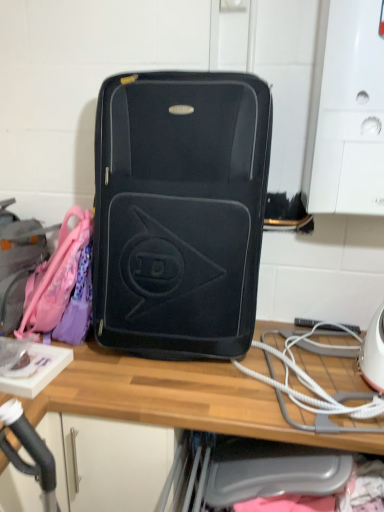
Question: Considering the relative sizes of matte black suitcase at center and wooden desk at center in the image provided, is matte black suitcase at center thinner than wooden desk at center?

Choices:
 (A) yes
 (B) no

Answer: (A)

Question: Is matte black suitcase at center beside wooden desk at center?

Choices:
 (A) yes
 (B) no

Answer: (B)

Question: From the image's perspective, does matte black suitcase at center appear lower than wooden desk at center?

Choices:
 (A) yes
 (B) no

Answer: (B)

Question: Does matte black suitcase at center have a lesser height compared to wooden desk at center?

Choices:
 (A) yes
 (B) no

Answer: (A)

Question: Does matte black suitcase at center have a greater height compared to wooden desk at center?

Choices:
 (A) yes
 (B) no

Answer: (B)

Question: Does matte black suitcase at center have a greater width compared to wooden desk at center?

Choices:
 (A) no
 (B) yes

Answer: (A)

Question: Considering the relative sizes of white cord at lower right and matte pink backpack at left in the image provided, is white cord at lower right wider than matte pink backpack at left?

Choices:
 (A) yes
 (B) no

Answer: (A)

Question: Does white cord at lower right appear on the right side of matte pink backpack at left?

Choices:
 (A) no
 (B) yes

Answer: (B)

Question: From the image's perspective, is white cord at lower right below matte pink backpack at left?

Choices:
 (A) no
 (B) yes

Answer: (B)

Question: Is white cord at lower right beside matte pink backpack at left?

Choices:
 (A) no
 (B) yes

Answer: (A)

Question: Does white cord at lower right have a larger size compared to matte pink backpack at left?

Choices:
 (A) yes
 (B) no

Answer: (B)

Question: Does white cord at lower right come behind matte pink backpack at left?

Choices:
 (A) no
 (B) yes

Answer: (A)

Question: Is matte black suitcase at center looking in the opposite direction of matte pink backpack at left?

Choices:
 (A) no
 (B) yes

Answer: (A)